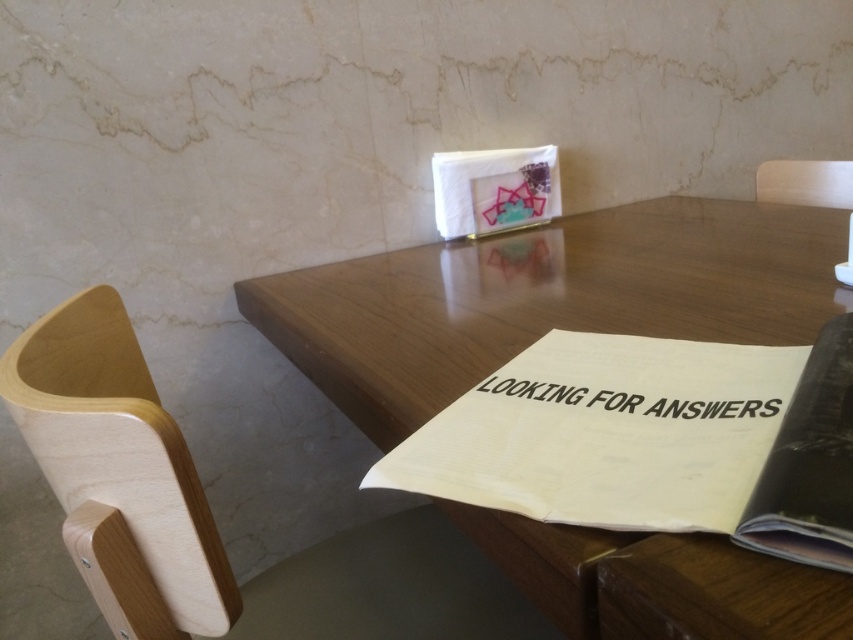
Does black paper at center have a lesser height compared to wooden chair at upper right?

Correct, black paper at center is not as tall as wooden chair at upper right.

Locate an element on the screen. black paper at center is located at coordinates (630, 400).

Locate an element on the screen. Image resolution: width=853 pixels, height=640 pixels. black paper at center is located at coordinates (630, 400).

Is point (766, 320) more distant than point (579, 426)?

That is True.

Is point (561, 220) positioned behind point (805, 408)?

Yes, point (561, 220) is behind point (805, 408).

Find the location of a particular element. wooden table at center is located at coordinates (550, 300).

Which is more to the right, wooden table at center or wooden chair at upper right?

wooden chair at upper right is more to the right.

Which is in front, point (358, 396) or point (839, 193)?

Positioned in front is point (358, 396).

Between point (299, 324) and point (843, 188), which one is positioned in front?

Positioned in front is point (299, 324).

You are a GUI agent. You are given a task and a screenshot of the screen. Output one action in this format:
    pyautogui.click(x=<x>, y=<y>)
    Task: Click on the wooden table at center
    This screenshot has height=640, width=853.
    Given the screenshot: What is the action you would take?
    pyautogui.click(x=550, y=300)